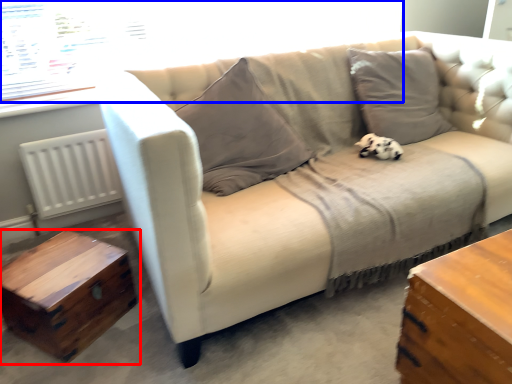
Question: Among these objects, which one is farthest to the camera, table (highlighted by a red box) or window screen (highlighted by a blue box)?

Choices:
 (A) table
 (B) window screen

Answer: (B)